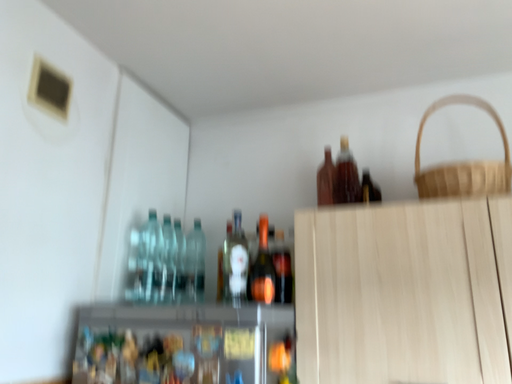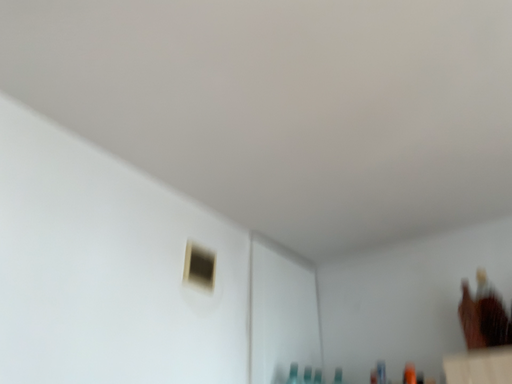
Question: Which way did the camera rotate in the video?

Choices:
 (A) rotated right
 (B) rotated left

Answer: (B)